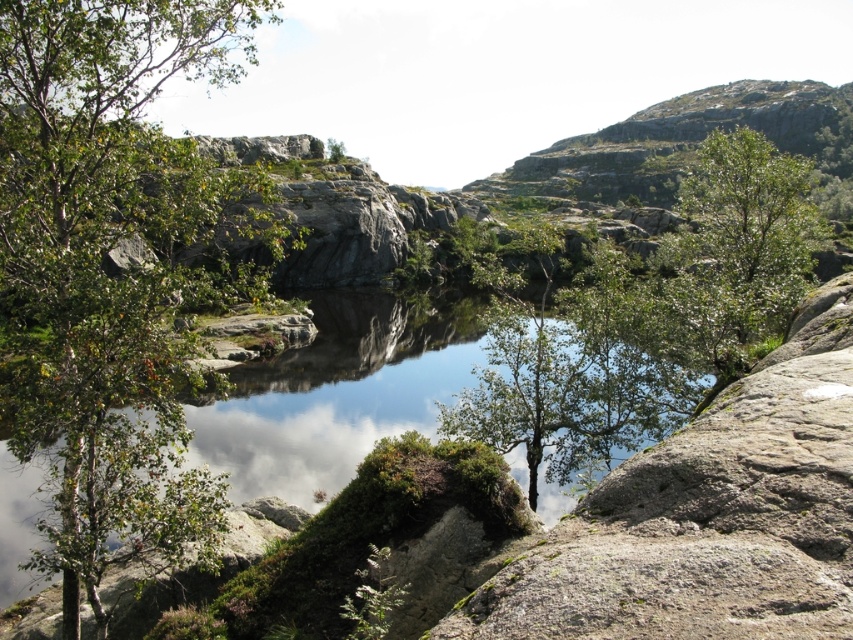
Question: Which is nearer to the green leafy tree at center?

Choices:
 (A) green leafy tree at left
 (B) clear water at center

Answer: (B)

Question: Based on their relative distances, which object is nearer to the clear water at center?

Choices:
 (A) green leafy tree at upper right
 (B) green leafy tree at center

Answer: (B)

Question: Is green leafy tree at left wider than green leafy tree at upper right?

Choices:
 (A) no
 (B) yes

Answer: (A)

Question: Which point is farther from the camera taking this photo?

Choices:
 (A) (587, 330)
 (B) (65, 435)

Answer: (A)

Question: Is green leafy tree at left further to camera compared to green leafy tree at center?

Choices:
 (A) no
 (B) yes

Answer: (A)

Question: Is green leafy tree at left closer to camera compared to green leafy tree at center?

Choices:
 (A) yes
 (B) no

Answer: (A)